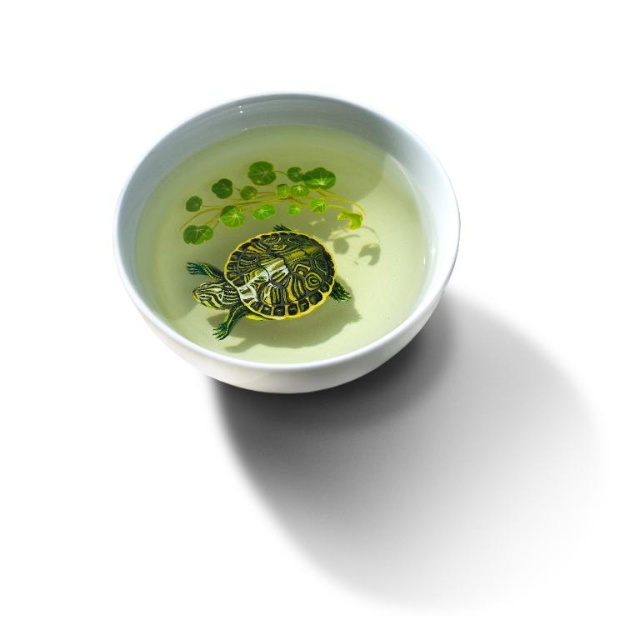
You are a photographer standing at a certain distance from the white ceramic bowl at center. You want to take a closeup photo of the turtle inside it. Based on the given information, is the current distance sufficient to capture a clear closeup of the turtle without moving closer?

The white ceramic bowl at center is 37.42 inches away from camera. Whether this distance is sufficient for a clear closeup depends on the camera lens capabilities. However, standard closeup photography typically requires being within 12 to 24 inches. Since 37.42 inches is beyond this range, the current distance may not be sufficient for a clear closeup without moving closer or using specialized equipment.